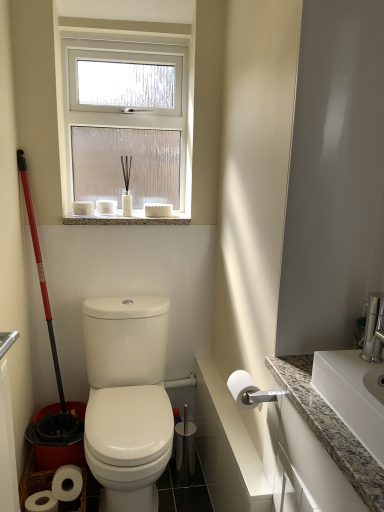
You are a GUI agent. You are given a task and a screenshot of the screen. Output one action in this format:
    pyautogui.click(x=<x>, y=<y>)
    Task: Click on the free spot to the left of white granite sink at right
    The height and width of the screenshot is (512, 384).
    Given the screenshot: What is the action you would take?
    pyautogui.click(x=316, y=411)